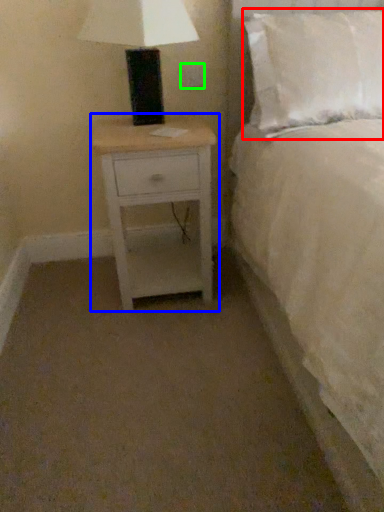
Question: Considering the real-world distances, which object is closest to pillow (highlighted by a red box)? nightstand (highlighted by a blue box) or electric outlet (highlighted by a green box).

Choices:
 (A) nightstand
 (B) electric outlet

Answer: (A)